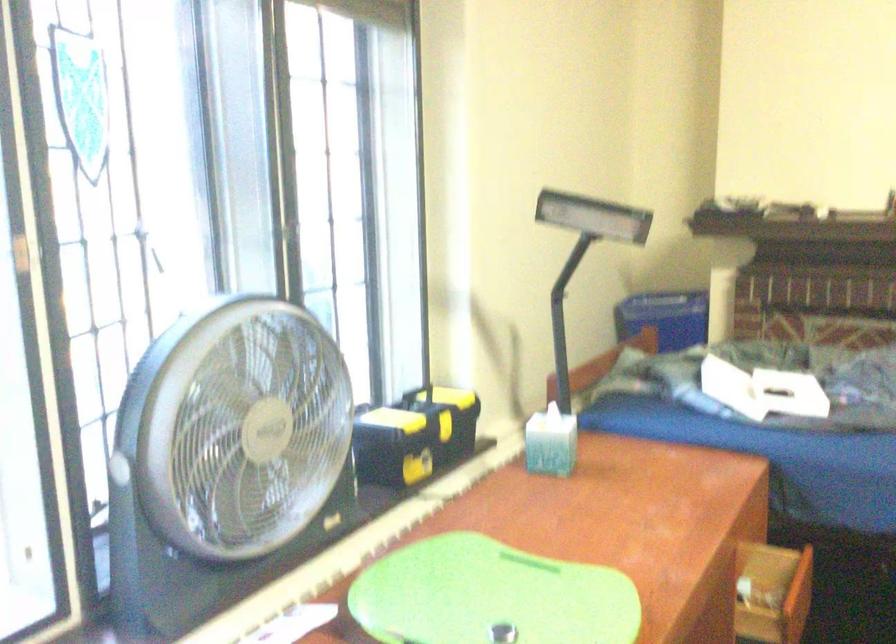
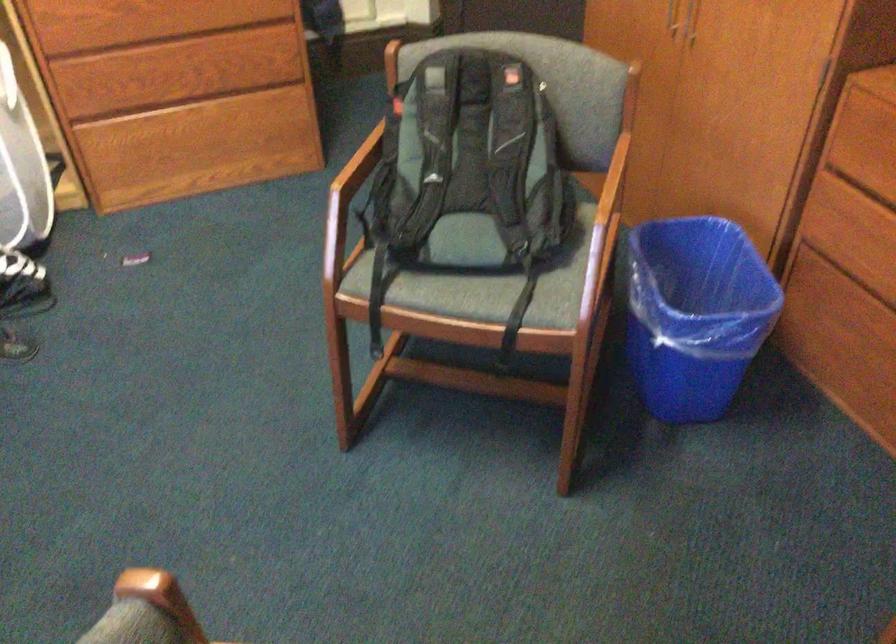
How did the camera likely rotate?

The camera's rotation is toward right-down.